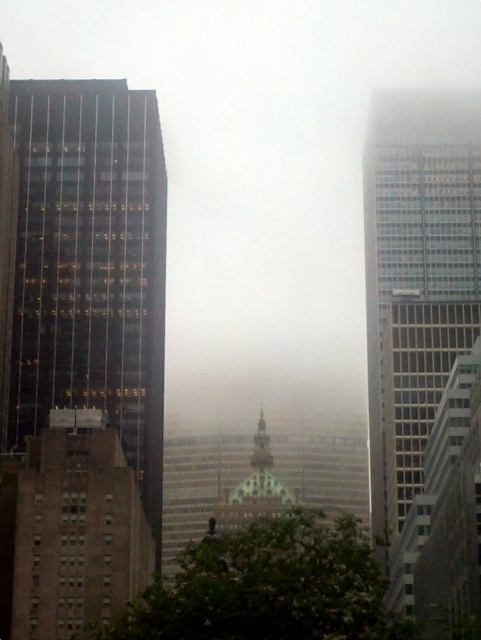
Question: Can you confirm if glassy reflective skyscraper at right is smaller than brown brick building at lower left?

Choices:
 (A) no
 (B) yes

Answer: (A)

Question: Among these objects, which one is farthest from the camera?

Choices:
 (A) brown brick building at lower left
 (B) dark glass skyscraper at left

Answer: (B)

Question: Which of the following is the farthest from the observer?

Choices:
 (A) dark glass skyscraper at left
 (B) brown brick building at lower left

Answer: (A)

Question: Is dark glass skyscraper at left to the left of brown brick building at lower left from the viewer's perspective?

Choices:
 (A) no
 (B) yes

Answer: (B)

Question: Is dark glass skyscraper at left thinner than glassy reflective skyscraper at right?

Choices:
 (A) no
 (B) yes

Answer: (B)

Question: Considering the real-world distances, which object is closest to the dark glass skyscraper at left?

Choices:
 (A) glassy reflective skyscraper at right
 (B) brown brick building at lower left

Answer: (B)